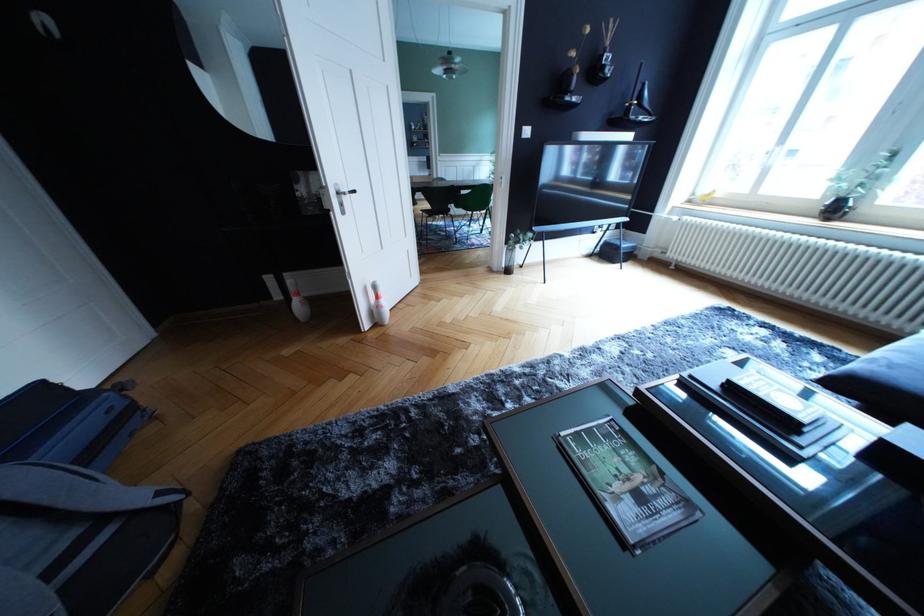
Where is `grey bag handle`? grey bag handle is located at coordinates (103, 581).